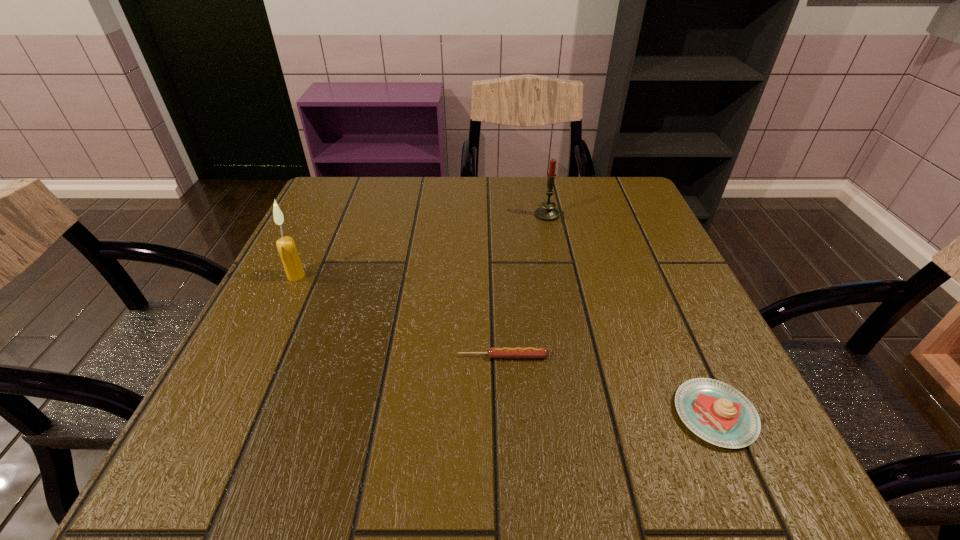
Where is `vacant space in between the shortest object and the second shortest object`? The width and height of the screenshot is (960, 540). vacant space in between the shortest object and the second shortest object is located at coordinates (609, 386).

Find the location of a particular element. The image size is (960, 540). free space between the nearer candle and the rightmost object is located at coordinates (506, 345).

The image size is (960, 540). What are the coordinates of `vacant space that is in between the farthest object and the nearer candle` in the screenshot? It's located at (421, 245).

This screenshot has width=960, height=540. I want to click on vacant area that lies between the rightmost object and the leftmost object, so click(x=506, y=345).

What are the coordinates of `object that ranks as the third closest to the shortest object` in the screenshot? It's located at [547, 212].

Where is `the closest object to the third object from right to left`? the closest object to the third object from right to left is located at coordinates (718, 413).

In order to click on vacant area in the image that satisfies the following two spatial constraints: 1. on the back side of the second tallest object; 2. on the right side of the leftmost object in this screenshot , I will do `click(325, 215)`.

This screenshot has height=540, width=960. What are the coordinates of `vacant space that satisfies the following two spatial constraints: 1. on the front side of the sausage; 2. on the right side of the left candle` in the screenshot? It's located at (257, 356).